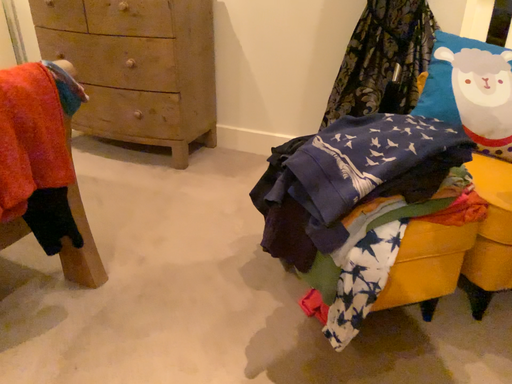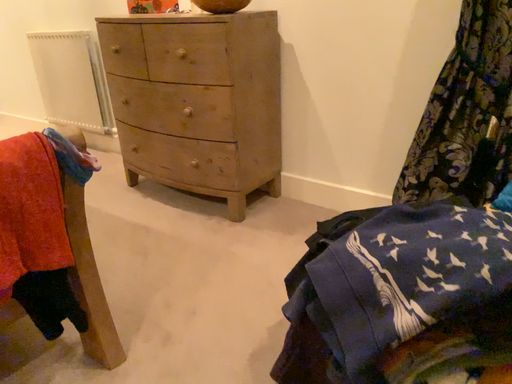
Question: How did the camera likely rotate when shooting the video?

Choices:
 (A) rotated left
 (B) rotated right

Answer: (A)